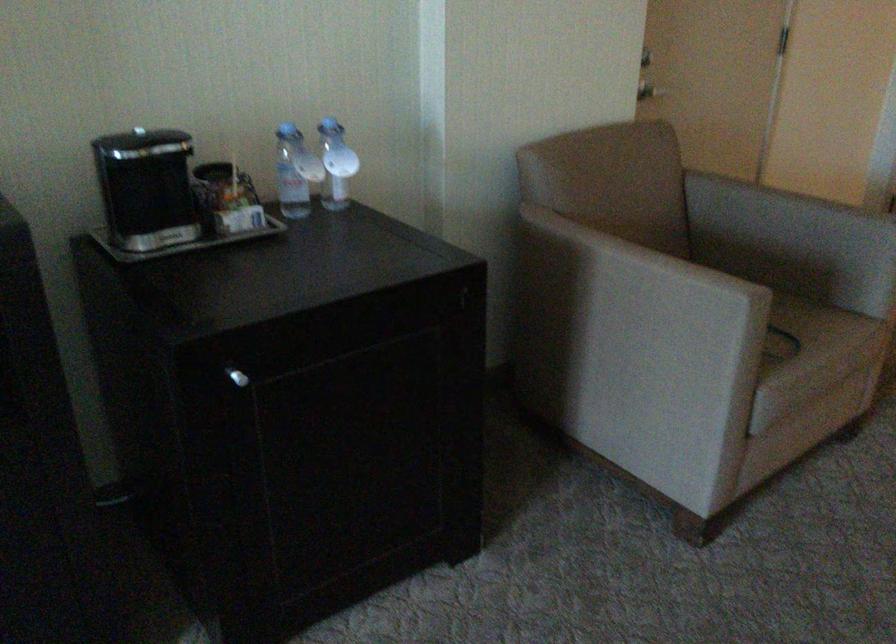
What are the coordinates of `chair armrest` in the screenshot? It's located at (631, 283).